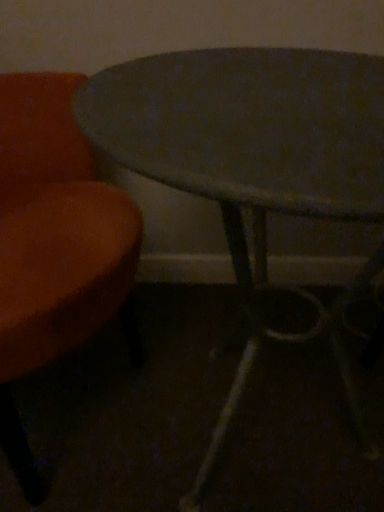
Question: From the image's perspective, would you say metallic gray table at center is positioned over velvet orange chair at left?

Choices:
 (A) yes
 (B) no

Answer: (B)

Question: Considering the relative positions of metallic gray table at center and velvet orange chair at left in the image provided, is metallic gray table at center to the left of velvet orange chair at left from the viewer's perspective?

Choices:
 (A) yes
 (B) no

Answer: (B)

Question: Is metallic gray table at center wider than velvet orange chair at left?

Choices:
 (A) yes
 (B) no

Answer: (B)

Question: Is metallic gray table at center not inside velvet orange chair at left?

Choices:
 (A) yes
 (B) no

Answer: (A)

Question: Can you confirm if metallic gray table at center is shorter than velvet orange chair at left?

Choices:
 (A) no
 (B) yes

Answer: (B)

Question: From a real-world perspective, is metallic gray table at center below velvet orange chair at left?

Choices:
 (A) no
 (B) yes

Answer: (B)

Question: Is velvet orange chair at left bigger than metallic gray table at center?

Choices:
 (A) no
 (B) yes

Answer: (B)

Question: Can you confirm if velvet orange chair at left is positioned to the left of metallic gray table at center?

Choices:
 (A) no
 (B) yes

Answer: (B)

Question: Can you confirm if velvet orange chair at left is smaller than metallic gray table at center?

Choices:
 (A) yes
 (B) no

Answer: (B)

Question: Considering the relative positions of velvet orange chair at left and metallic gray table at center in the image provided, is velvet orange chair at left to the right of metallic gray table at center from the viewer's perspective?

Choices:
 (A) yes
 (B) no

Answer: (B)

Question: Can metallic gray table at center be found inside velvet orange chair at left?

Choices:
 (A) yes
 (B) no

Answer: (B)

Question: Can you confirm if velvet orange chair at left is wider than metallic gray table at center?

Choices:
 (A) yes
 (B) no

Answer: (A)

Question: Is metallic gray table at center situated inside velvet orange chair at left or outside?

Choices:
 (A) outside
 (B) inside

Answer: (A)